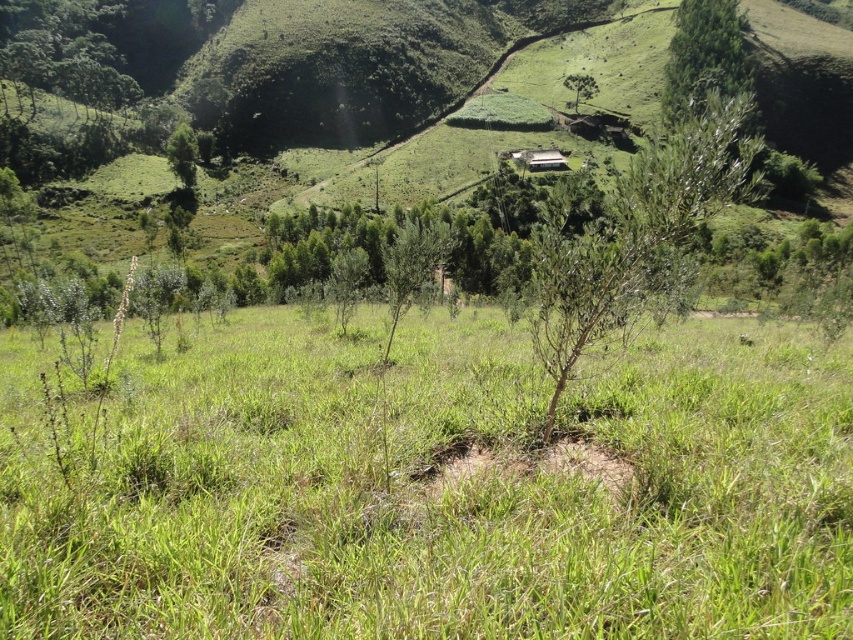
Is green grassy at center to the left of white corrugated metal hut at upper center from the viewer's perspective?

Indeed, green grassy at center is positioned on the left side of white corrugated metal hut at upper center.

From the picture: Who is higher up, green grassy at center or white corrugated metal hut at upper center?

Positioned higher is white corrugated metal hut at upper center.

Identify the location of green grassy at center. The width and height of the screenshot is (853, 640). (430, 484).

Can you confirm if green leafy tree at upper right is thinner than green leafy tree at upper left?

No.

This screenshot has height=640, width=853. What do you see at coordinates (704, 54) in the screenshot?
I see `green leafy tree at upper right` at bounding box center [704, 54].

This screenshot has width=853, height=640. Identify the location of green leafy tree at upper right. (704, 54).

Between point (399, 282) and point (548, 154), which one is positioned behind?

Point (548, 154)

Consider the image. Does green leafy tree at center have a larger size compared to white corrugated metal hut at upper center?

Indeed, green leafy tree at center has a larger size compared to white corrugated metal hut at upper center.

At what (x,y) coordinates should I click in order to perform the action: click on green leafy tree at center. Please return your answer as a coordinate pair (x, y). The height and width of the screenshot is (640, 853). Looking at the image, I should click on (412, 266).